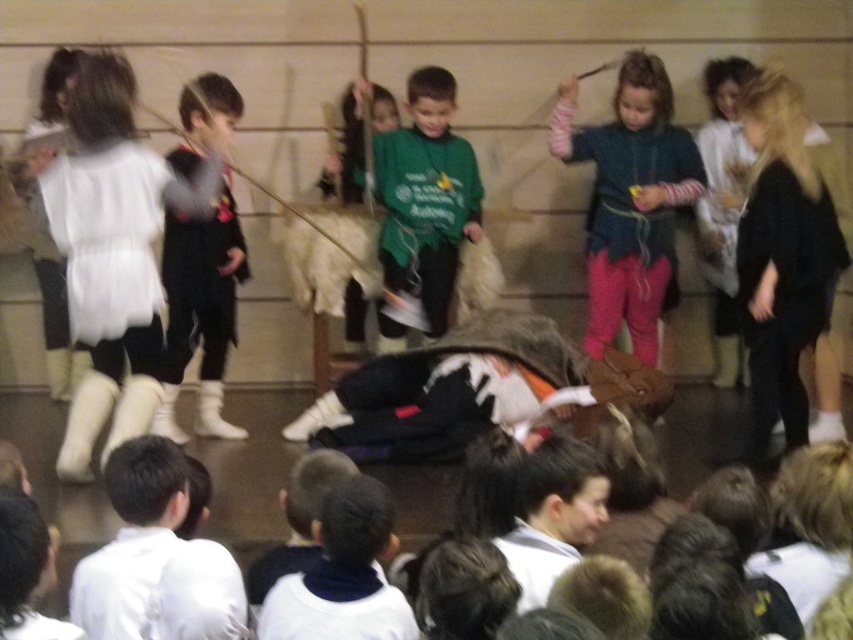
Is point (798, 337) less distant than point (224, 113)?

Yes, point (798, 337) is closer to viewer.

Who is taller, black sweater at right or matte black vest at left?

Standing taller between the two is black sweater at right.

Describe the element at coordinates (782, 257) in the screenshot. The width and height of the screenshot is (853, 640). I see `black sweater at right` at that location.

You are a GUI agent. You are given a task and a screenshot of the screen. Output one action in this format:
    pyautogui.click(x=<x>, y=<y>)
    Task: Click on the black sweater at right
    The width and height of the screenshot is (853, 640).
    Given the screenshot: What is the action you would take?
    pyautogui.click(x=782, y=257)

Who is positioned more to the right, teal sweater at center or green matte shirt at center?

teal sweater at center

Is teal sweater at center thinner than green matte shirt at center?

Correct, teal sweater at center's width is less than green matte shirt at center's.

Between point (631, 134) and point (450, 81), which one is positioned in front?

Point (450, 81) is in front.

This screenshot has width=853, height=640. In order to click on teal sweater at center in this screenshot , I will do `click(630, 202)`.

Does teal sweater at center appear on the left side of matte black vest at left?

In fact, teal sweater at center is to the right of matte black vest at left.

Is teal sweater at center behind matte black vest at left?

Yes, it is behind matte black vest at left.

Who is more distant from viewer, [640,161] or [210,394]?

Point [640,161]

At what (x,y) coordinates should I click in order to perform the action: click on teal sweater at center. Please return your answer as a coordinate pair (x, y). Looking at the image, I should click on (630, 202).